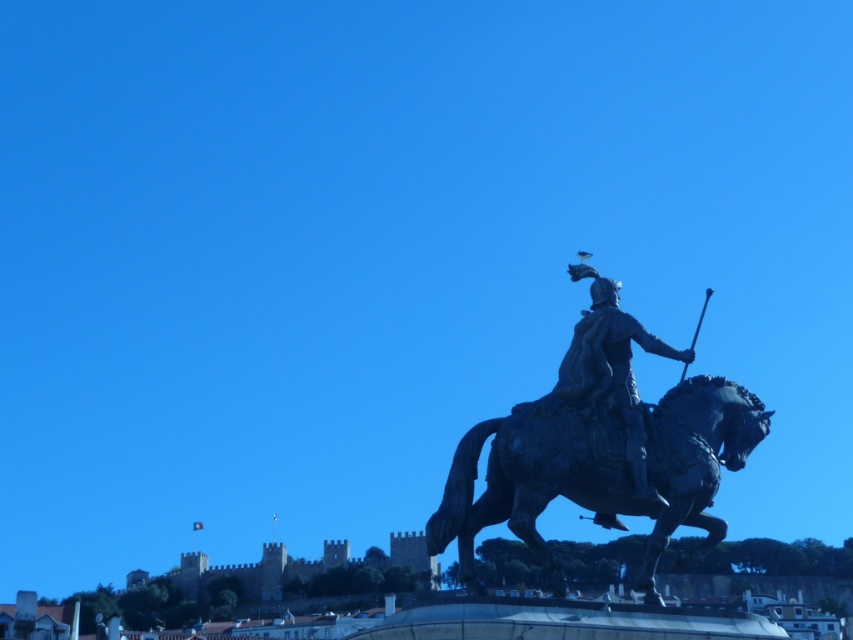
From the picture: You are an art student standing in front of the statue and want to sketch the shiny black horse at center and the polished bronze statue at center. Which object should you focus on first if you want to draw the one that is nearer to you?

The shiny black horse at center is closer to the viewer than the polished bronze statue at center, so you should focus on the shiny black horse at center first.

You are an art student analyzing the statue. You notice the shiny black horse at center and the polished bronze statue at center. Which object is taller?

The polished bronze statue at center is taller than the shiny black horse at center.